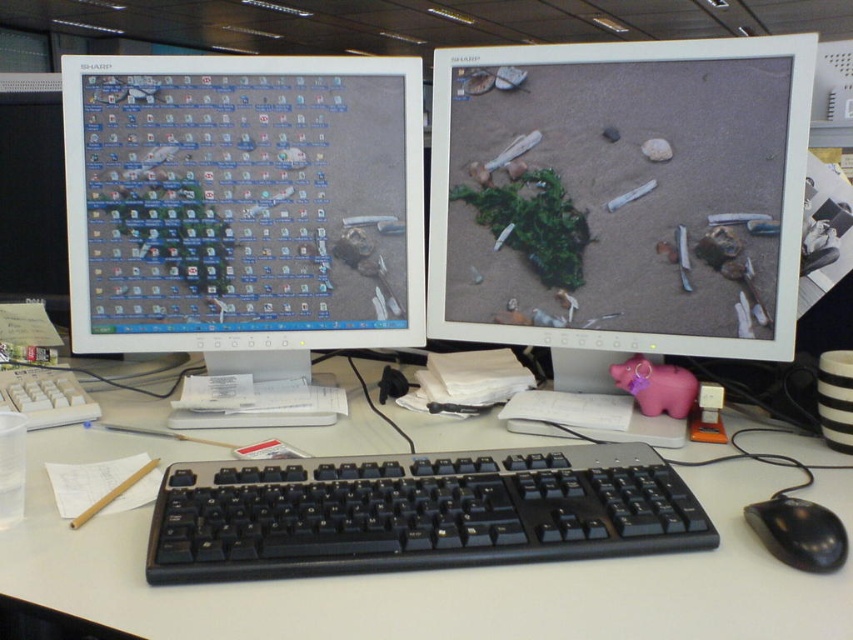
From the picture: You are a user trying to reach the point at the bottom right corner of the desk. You are currently at point (474,477). Is the point (720,499) closer to you or further away?

The point at (720,499) is behind point (474,477), so it is further away from you.

You are a remote worker who needs to reach the black plastic mouse at lower right without moving the white plastic keyboard at center. Is this possible based on their positions?

The white plastic keyboard at center is above the black plastic mouse at lower right, so you can reach the black plastic mouse at lower right without moving the keyboard since it is positioned below the keyboard.

You are organizing your desk and want to place a new wireless charger between the white plastic keyboard at center and the black plastic mouse at lower right. Based on their current positions, which side of the keyboard should you place the charger so it doesn

The white plastic keyboard at center is positioned on the left side of black plastic mouse at lower right, so you should place the wireless charger to the right of the white plastic keyboard at center to position it between them.